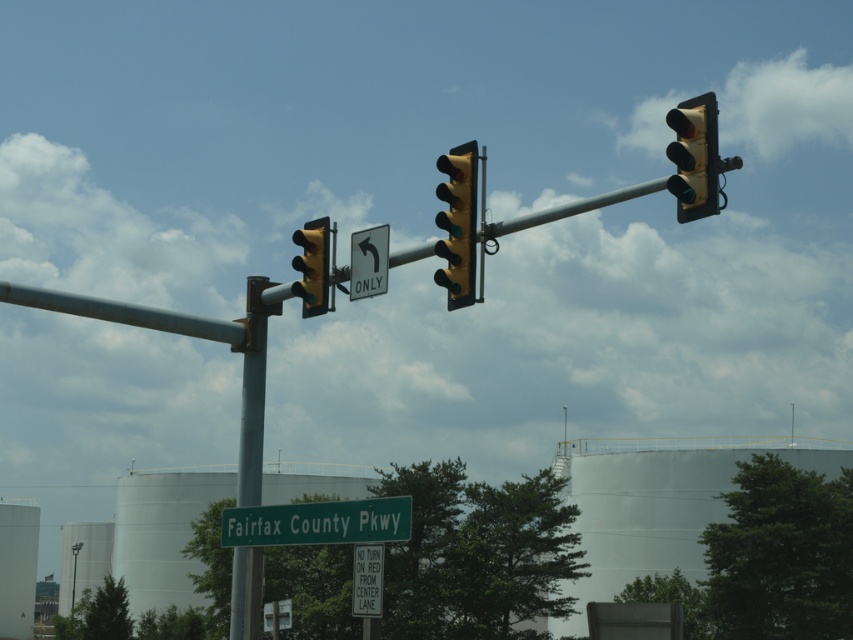
You are a delivery driver approaching the intersection and need to check the distance between the green metallic street sign at center and the black plastic traffic light at upper right. Which one is closer to your current position?

The green metallic street sign at center is closer to your current position because it is further to the viewer than the black plastic traffic light at upper right, meaning it appears nearer in the scene.

Looking at this image, you are a driver approaching the intersection and see the green metallic street sign at center and the black plastic traffic light at upper right. Which object is located higher in the image?

The black plastic traffic light at upper right is positioned higher than the green metallic street sign at center, so the black plastic traffic light at upper right is higher.